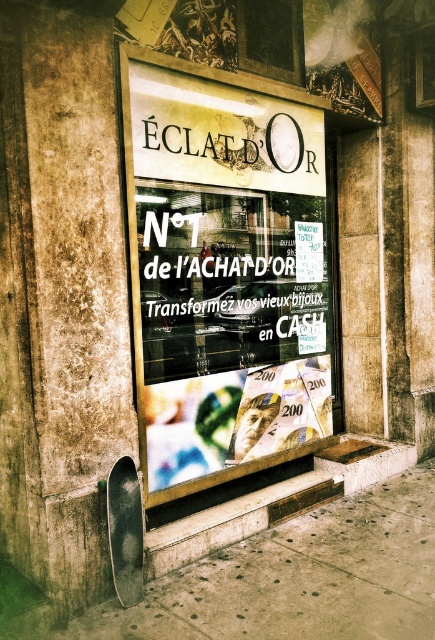
You are a customer entering the jewelry store and see the white paper at center and the metallic gray skateboard at lower left in the storefront window. Which object is closer to you as you look through the window?

The white paper at center is closer to you because the metallic gray skateboard at lower left is behind it.

You are a delivery person who needs to place a metallic gray skateboard at lower left inside the store through the window. Given that the matte glass shop window at center is the only entrance available, can the skateboard fit through the window?

The matte glass shop window at center has a larger size compared to the metallic gray skateboard at lower left, so the skateboard can fit through the window.

You are a delivery person with a package that requires a flat surface to place. You see the smooth concrete pavement at lower left and the metallic gray skateboard at lower left. Which surface is more suitable for placing the package?

The smooth concrete pavement at lower left is more suitable for placing the package since it is a flat surface, while the metallic gray skateboard at lower left is likely to move or be unstable.